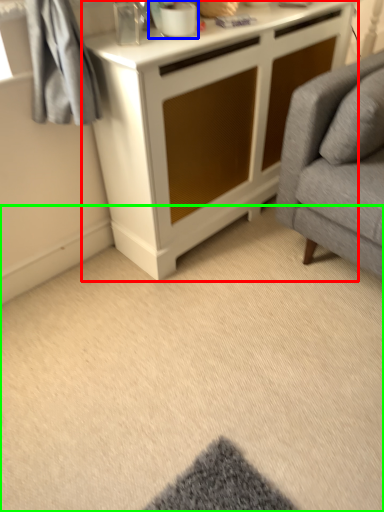
Question: Estimate the real-world distances between objects in this image. Which object is closer to cabinetry (highlighted by a red box), appliance (highlighted by a blue box) or plain (highlighted by a green box)?

Choices:
 (A) appliance
 (B) plain

Answer: (A)